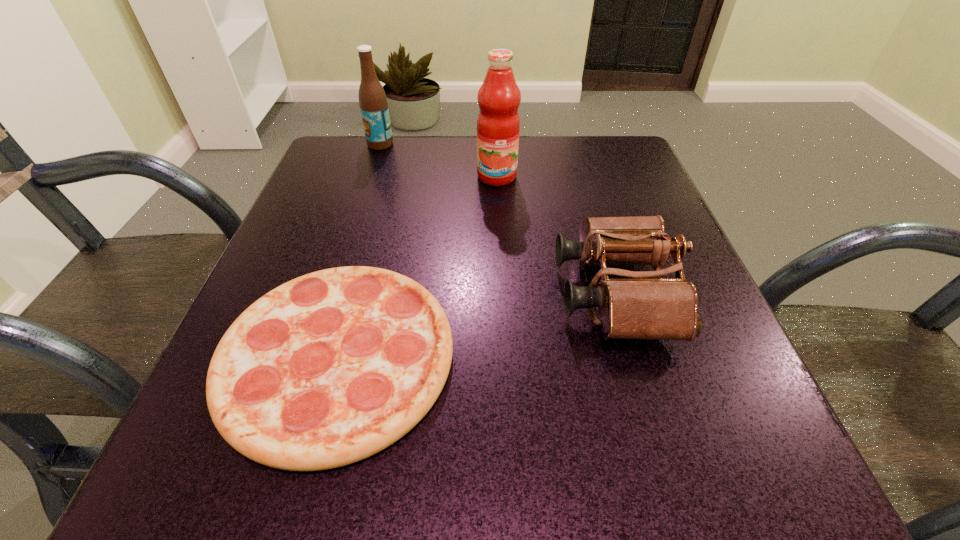
Find the location of a particular element. vacant space that satisfies the following two spatial constraints: 1. through the eyepieces of the binoculars; 2. on the front side of the pizza is located at coordinates (633, 357).